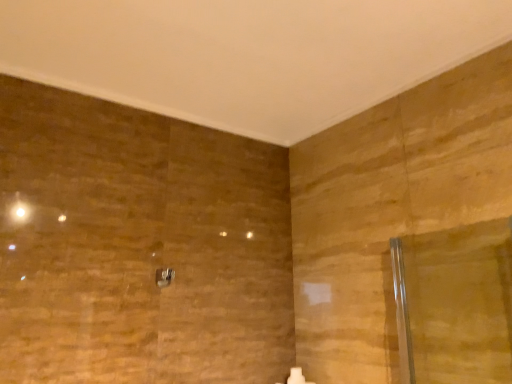
Describe the element at coordinates (164, 277) in the screenshot. Image resolution: width=512 pixels, height=384 pixels. I see `metallic silver shower at center` at that location.

Find the location of a particular element. The height and width of the screenshot is (384, 512). metallic silver shower at center is located at coordinates (164, 277).

Measure the distance between metallic silver shower at center and camera.

metallic silver shower at center is 1.46 meters from camera.

This screenshot has height=384, width=512. In order to click on metallic silver shower at center in this screenshot , I will do `click(164, 277)`.